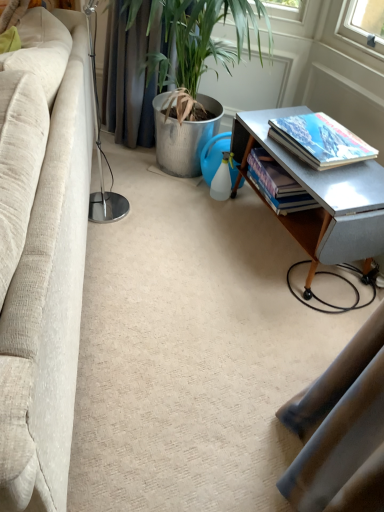
Question: From the image's perspective, is metallic gray table at right beneath hardcover book at right, the 2th book viewed from the front?

Choices:
 (A) yes
 (B) no

Answer: (A)

Question: Does metallic gray table at right lie behind hardcover book at right, which appears as the 1th book when viewed from the back?

Choices:
 (A) no
 (B) yes

Answer: (A)

Question: Is metallic gray table at right facing away from hardcover book at right, which appears as the 1th book when viewed from the back?

Choices:
 (A) no
 (B) yes

Answer: (B)

Question: Are metallic gray table at right and hardcover book at right, the 2th book viewed from the front, beside each other?

Choices:
 (A) no
 (B) yes

Answer: (A)

Question: Does metallic gray table at right have a larger size compared to hardcover book at right, which appears as the 1th book when viewed from the back?

Choices:
 (A) yes
 (B) no

Answer: (A)

Question: Can you confirm if metallic gray table at right is thinner than hardcover book at right, which appears as the 1th book when viewed from the back?

Choices:
 (A) yes
 (B) no

Answer: (B)

Question: From the image's perspective, is metallic gray table at right located above hardcover book at right, the first book positioned from the front?

Choices:
 (A) yes
 (B) no

Answer: (B)

Question: From a real-world perspective, is metallic gray table at right below hardcover book at right, the first book positioned from the front?

Choices:
 (A) no
 (B) yes

Answer: (B)

Question: From the image's perspective, does metallic gray table at right appear lower than hardcover book at right, acting as the second book starting from the back?

Choices:
 (A) yes
 (B) no

Answer: (A)

Question: Does metallic gray table at right have a larger size compared to hardcover book at right, the first book positioned from the front?

Choices:
 (A) yes
 (B) no

Answer: (A)

Question: Is metallic gray table at right oriented away from hardcover book at right, the first book positioned from the front?

Choices:
 (A) no
 (B) yes

Answer: (A)

Question: Can you confirm if metallic gray table at right is thinner than hardcover book at right, acting as the second book starting from the back?

Choices:
 (A) yes
 (B) no

Answer: (B)

Question: Is hardcover book at right, acting as the second book starting from the back, facing towards hardcover book at right, the 2th book viewed from the front?

Choices:
 (A) no
 (B) yes

Answer: (A)